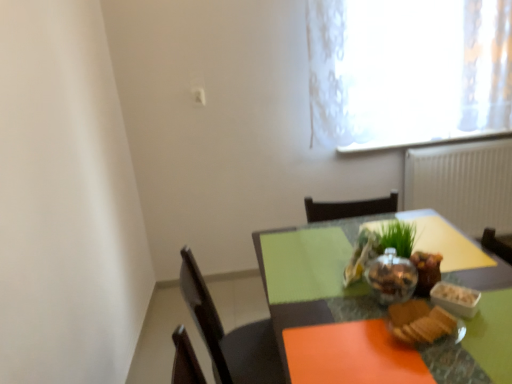
Question: In which direction should I rotate to look at shiny metallic bowl at center, the first food positioned from the back?

Choices:
 (A) right
 (B) left

Answer: (A)

Question: From the image's perspective, is matte glass bowl at center on top of slightly toasted bread at lower right, acting as the third food starting from the back?

Choices:
 (A) no
 (B) yes

Answer: (A)

Question: Does matte glass bowl at center have a larger size compared to slightly toasted bread at lower right, the first food in the front-to-back sequence?

Choices:
 (A) yes
 (B) no

Answer: (A)

Question: Is matte glass bowl at center closer to camera compared to slightly toasted bread at lower right, the first food in the front-to-back sequence?

Choices:
 (A) yes
 (B) no

Answer: (B)

Question: Considering the relative sizes of matte glass bowl at center and slightly toasted bread at lower right, the first food in the front-to-back sequence, in the image provided, is matte glass bowl at center wider than slightly toasted bread at lower right, the first food in the front-to-back sequence,?

Choices:
 (A) no
 (B) yes

Answer: (B)

Question: Considering the relative positions of matte glass bowl at center and slightly toasted bread at lower right, the first food in the front-to-back sequence, in the image provided, is matte glass bowl at center behind slightly toasted bread at lower right, the first food in the front-to-back sequence,?

Choices:
 (A) no
 (B) yes

Answer: (B)

Question: Considering the relative sizes of matte glass bowl at center and slightly toasted bread at lower right, the first food in the front-to-back sequence, in the image provided, is matte glass bowl at center taller than slightly toasted bread at lower right, the first food in the front-to-back sequence,?

Choices:
 (A) yes
 (B) no

Answer: (A)

Question: Considering the relative sizes of white textured radiator at right and shiny metallic bowl at center, the second food from the front, in the image provided, is white textured radiator at right bigger than shiny metallic bowl at center, the second food from the front,?

Choices:
 (A) yes
 (B) no

Answer: (A)

Question: Does white textured radiator at right have a lesser width compared to shiny metallic bowl at center, the second food from the front?

Choices:
 (A) no
 (B) yes

Answer: (B)

Question: Does white textured radiator at right appear on the left side of shiny metallic bowl at center, which is the 2th food in back-to-front order?

Choices:
 (A) no
 (B) yes

Answer: (A)

Question: Is white textured radiator at right wider than shiny metallic bowl at center, which is the 2th food in back-to-front order?

Choices:
 (A) yes
 (B) no

Answer: (B)

Question: From a real-world perspective, does white textured radiator at right stand above shiny metallic bowl at center, the second food from the front?

Choices:
 (A) yes
 (B) no

Answer: (B)

Question: Can you confirm if white textured radiator at right is positioned to the right of shiny metallic bowl at center, the second food from the front?

Choices:
 (A) no
 (B) yes

Answer: (B)

Question: Can you confirm if slightly toasted bread at lower right, acting as the third food starting from the back, is taller than matte glass bowl at center?

Choices:
 (A) no
 (B) yes

Answer: (A)